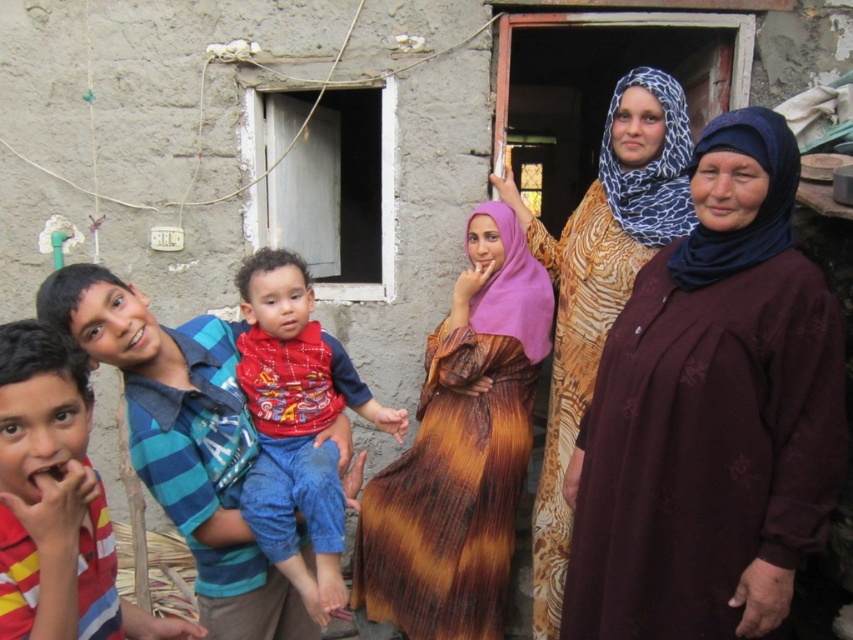
Can you confirm if maroon fabric dress at center is positioned below brown textured dress at center?

Actually, maroon fabric dress at center is above brown textured dress at center.

Between point (633, 497) and point (525, 444), which one is positioned in front?

Point (633, 497) is in front.

Does point (776, 196) come in front of point (415, 621)?

Yes, it is.

I want to click on maroon fabric dress at center, so click(x=711, y=413).

Between point (683, 508) and point (103, 573), which one is positioned in front?

Point (103, 573)

Does maroon fabric dress at center appear under striped cotton shirt at lower left?

No.

Is point (621, 518) less distant than point (96, 611)?

No, it is behind (96, 611).

This screenshot has height=640, width=853. I want to click on maroon fabric dress at center, so click(711, 413).

Can you confirm if brown textured dress at center is positioned below printed silk dress at center?

Yes, brown textured dress at center is below printed silk dress at center.

Where is `brown textured dress at center`? The width and height of the screenshot is (853, 640). brown textured dress at center is located at coordinates (461, 451).

This screenshot has height=640, width=853. Find the location of `brown textured dress at center`. brown textured dress at center is located at coordinates (461, 451).